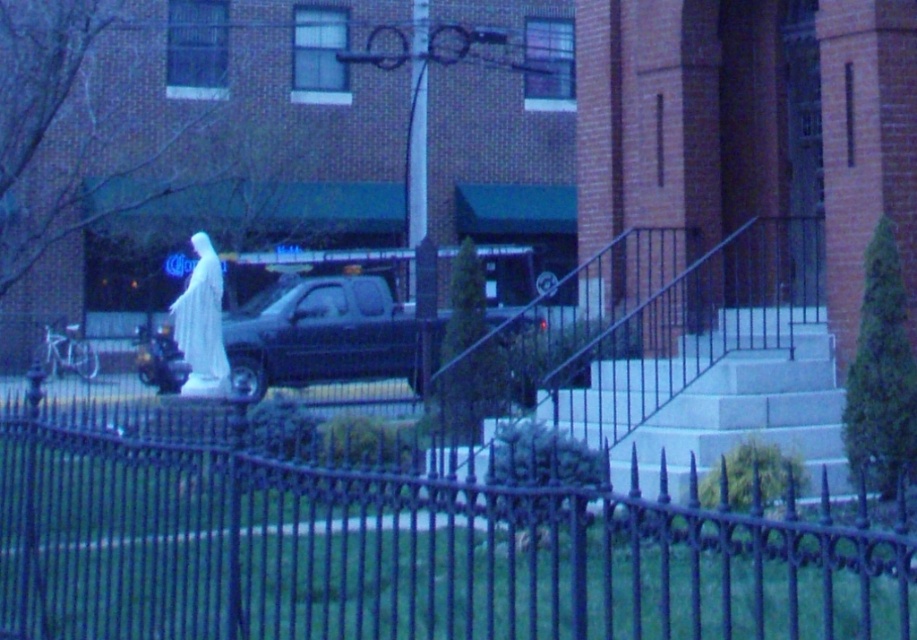
You are a delivery person trying to see if the matte black truck at center can pass through the gap between the black wrought iron fence at center and the building. Based on their heights, can the truck pass through without hitting the fence?

The black wrought iron fence at center has a lesser height compared to matte black truck at center. Since the fence is shorter than the truck, the truck can pass through the gap without hitting the fence as long as there is enough clearance horizontally.

You are standing in front of the brick building with the green awning. You want to walk to the statue near the pickup truck but need to know if you can step over the black wrought iron fence at center. Can you do it if your maximum stepping distance is 10 feet?

The distance of black wrought iron fence at center from viewer is 9.45 feet, so yes, you can step over it since your maximum stepping distance is 10 feet which is greater than 9.45 feet.

You are a delivery person trying to see if the white marble statue at center is visible from the street beyond the black wrought iron fence at center. Based on their heights, can you see the statue over the fence?

The black wrought iron fence at center is taller than the white marble statue at center, so the statue would be obscured by the fence and not visible from the street beyond.